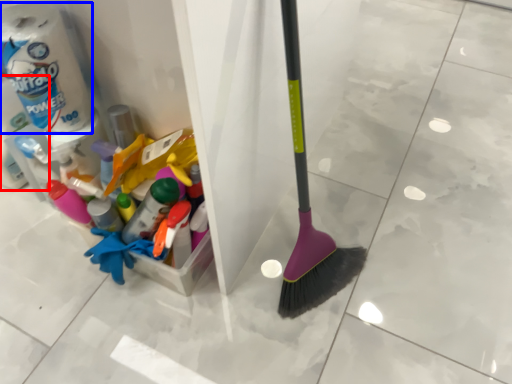
Question: Among these objects, which one is farthest to the camera, toilet paper (highlighted by a red box) or toilet paper (highlighted by a blue box)?

Choices:
 (A) toilet paper
 (B) toilet paper

Answer: (A)